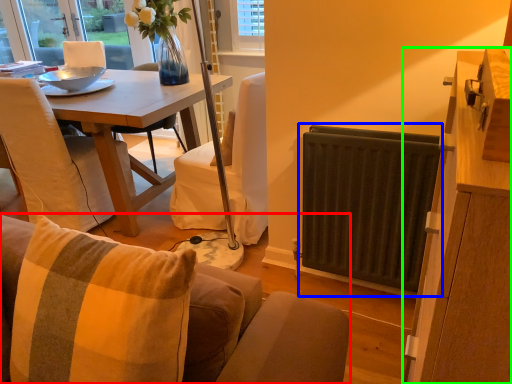
Question: Estimate the real-world distances between objects in this image. Which object is closer to studio couch (highlighted by a red box), radiator (highlighted by a blue box) or cabinetry (highlighted by a green box)?

Choices:
 (A) radiator
 (B) cabinetry

Answer: (B)